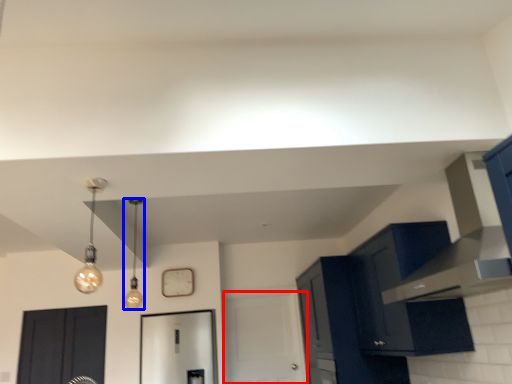
Question: Which object is further to the camera taking this photo, door (highlighted by a red box) or light fixture (highlighted by a blue box)?

Choices:
 (A) door
 (B) light fixture

Answer: (A)